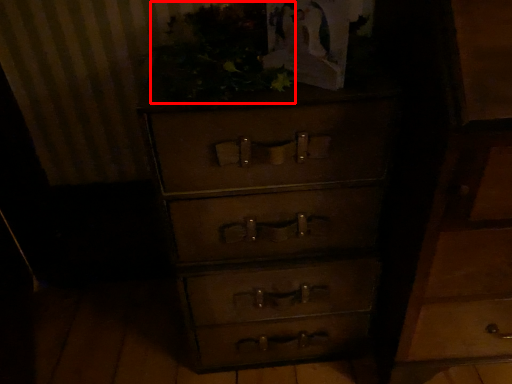
Question: Considering the relative positions of vegetation (annotated by the red box) and chest of drawers in the image provided, where is vegetation (annotated by the red box) located with respect to the staircase?

Choices:
 (A) left
 (B) right

Answer: (A)